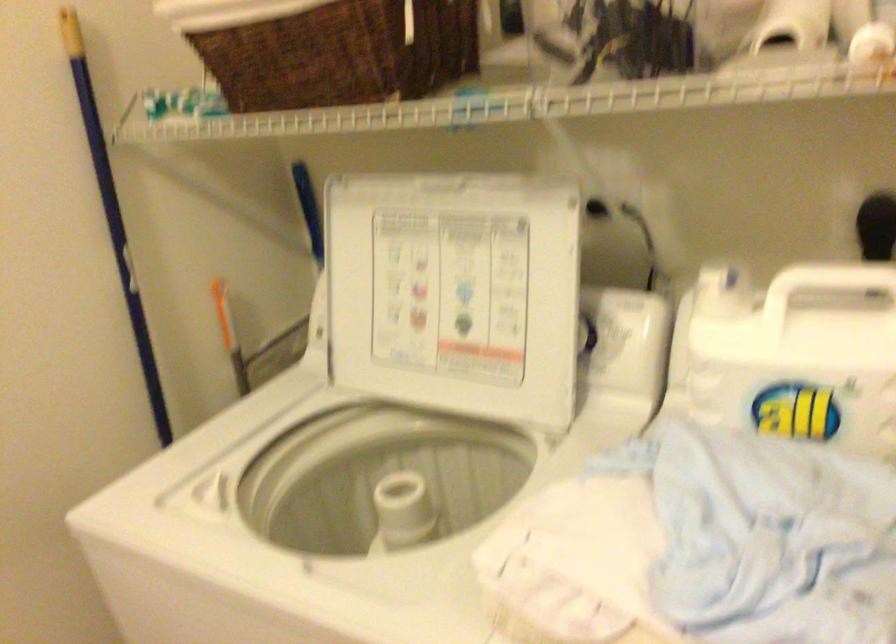
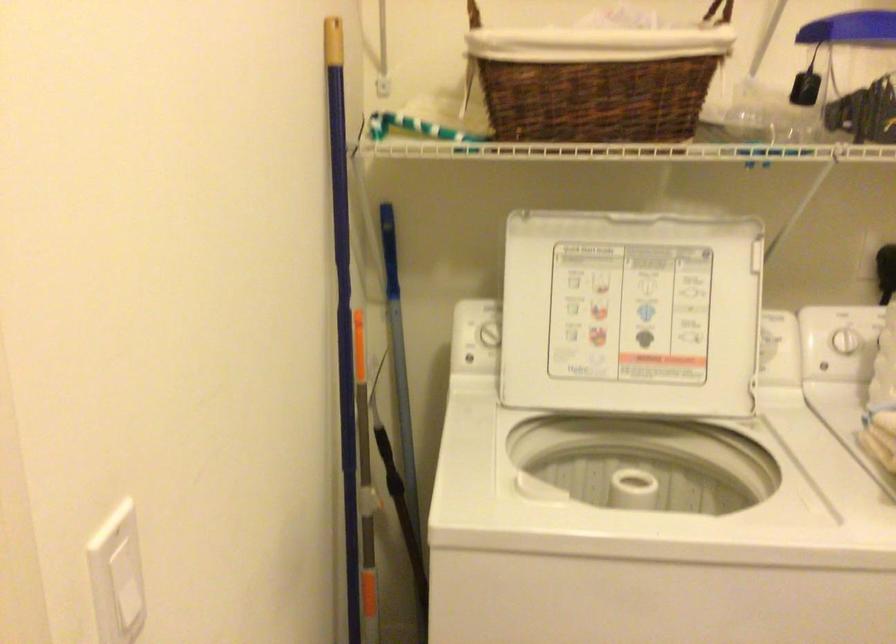
Find the pixel in the second image that matches point (712, 345) in the first image.

(845, 341)